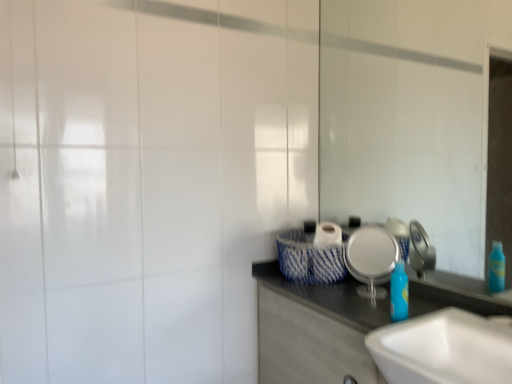
Describe the element at coordinates (314, 329) in the screenshot. I see `white glossy cabinet at lower right` at that location.

At what (x,y) coordinates should I click in order to perform the action: click on white glossy cabinet at lower right. Please return your answer as a coordinate pair (x, y). This screenshot has width=512, height=384. Looking at the image, I should click on 314,329.

This screenshot has width=512, height=384. In order to click on blue plastic bottle at center in this screenshot , I will do point(399,293).

What is the approximate height of silver metallic plate at center?

It is 24.47 centimeters.

You are a GUI agent. You are given a task and a screenshot of the screen. Output one action in this format:
    pyautogui.click(x=<x>, y=<y>)
    Task: Click on the white glossy cabinet at lower right
    
    Given the screenshot: What is the action you would take?
    pyautogui.click(x=314, y=329)

From the image's perspective, between blue plastic bottle at center and white glossy sink at lower right, which one is located above?

blue plastic bottle at center.

Which is in front, point (397, 285) or point (490, 344)?

Positioned in front is point (490, 344).

Which object is further away from the camera taking this photo, blue plastic bottle at center or white glossy sink at lower right?

blue plastic bottle at center is behind.

Is the depth of silver metallic plate at center greater than that of white glossy mirror at upper right?

Yes, silver metallic plate at center is further from the camera.

Between silver metallic plate at center and white glossy mirror at upper right, which one has larger width?

With larger width is silver metallic plate at center.

Which of these two, silver metallic plate at center or white glossy mirror at upper right, is smaller?

silver metallic plate at center is smaller.

The height and width of the screenshot is (384, 512). Identify the location of plate located below the white glossy mirror at upper right (from the image's perspective). (371, 255).

In the image, is white glossy sink at lower right positioned in front of or behind white glossy mirror at upper right?

In the image, white glossy sink at lower right appears in front of white glossy mirror at upper right.

What's the angular difference between white glossy sink at lower right and white glossy mirror at upper right's facing directions?

0.676 degrees separate the facing orientations of white glossy sink at lower right and white glossy mirror at upper right.

Based on the photo, is white glossy sink at lower right at the left side of white glossy mirror at upper right?

Yes.

Which is closer, [466,356] or [429,116]?

Point [466,356].

Considering the relative sizes of white glossy sink at lower right and white glossy cabinet at lower right in the image provided, is white glossy sink at lower right thinner than white glossy cabinet at lower right?

In fact, white glossy sink at lower right might be wider than white glossy cabinet at lower right.

Would you say white glossy sink at lower right is inside or outside white glossy cabinet at lower right?

white glossy sink at lower right lies within the bounds of white glossy cabinet at lower right.

Visually, is white glossy sink at lower right positioned to the left or to the right of white glossy cabinet at lower right?

Based on their positions, white glossy sink at lower right is located to the right of white glossy cabinet at lower right.

Is the surface of white glossy sink at lower right in direct contact with white glossy cabinet at lower right?

No, white glossy sink at lower right is not touching white glossy cabinet at lower right.

Considering the points (444, 379) and (360, 230), which point is in front, point (444, 379) or point (360, 230)?

Point (444, 379)

How far apart are white glossy sink at lower right and silver metallic plate at center?

The distance of white glossy sink at lower right from silver metallic plate at center is 13.04 inches.

Is white glossy sink at lower right oriented away from silver metallic plate at center?

No.

From a real-world perspective, who is located lower, white glossy sink at lower right or silver metallic plate at center?

white glossy sink at lower right.

Find the location of a particular element. The height and width of the screenshot is (384, 512). mirror located on the right of white glossy sink at lower right is located at coordinates (410, 116).

From a real-world perspective, which object rests below the other?

white glossy sink at lower right.

From the image's perspective, would you say white glossy mirror at upper right is shown under white glossy sink at lower right?

Actually, white glossy mirror at upper right appears above white glossy sink at lower right in the image.

Based on the photo, does white glossy mirror at upper right have a lesser height compared to white glossy sink at lower right?

Incorrect, the height of white glossy mirror at upper right does not fall short of that of white glossy sink at lower right.

Is silver metallic plate at center placed right next to blue plastic bottle at center?

silver metallic plate at center is not next to blue plastic bottle at center, and they're not touching.

Who is taller, silver metallic plate at center or blue plastic bottle at center?

Standing taller between the two is silver metallic plate at center.

Is silver metallic plate at center to the left of blue plastic bottle at center from the viewer's perspective?

Correct, you'll find silver metallic plate at center to the left of blue plastic bottle at center.

Between silver metallic plate at center and blue plastic bottle at center, which one has larger width?

silver metallic plate at center is wider.

This screenshot has height=384, width=512. I want to click on sink on the right of the blue plastic bottle at center, so click(x=444, y=349).

Where is `mirror in front of the silver metallic plate at center`? This screenshot has height=384, width=512. mirror in front of the silver metallic plate at center is located at coordinates (410, 116).

Which object lies further to the anchor point white glossy sink at lower right, white glossy mirror at upper right or blue plastic bottle at center?

white glossy mirror at upper right is positioned further to the anchor white glossy sink at lower right.

Looking at the image, which one is located closer to white glossy mirror at upper right, silver metallic plate at center or white glossy cabinet at lower right?

The object closer to white glossy mirror at upper right is silver metallic plate at center.

In the scene shown: Looking at the image, which one is located closer to blue plastic bottle at center, white glossy cabinet at lower right or silver metallic plate at center?

silver metallic plate at center is closer to blue plastic bottle at center.

Estimate the real-world distances between objects in this image. Which object is further from white glossy sink at lower right, silver metallic plate at center or white glossy cabinet at lower right?

silver metallic plate at center lies further to white glossy sink at lower right than the other object.

Based on their spatial positions, is silver metallic plate at center or blue plastic bottle at center closer to white glossy cabinet at lower right?

silver metallic plate at center is closer to white glossy cabinet at lower right.

Considering their positions, is white glossy cabinet at lower right positioned closer to white glossy sink at lower right than blue plastic bottle at center?

Among the two, blue plastic bottle at center is located nearer to white glossy sink at lower right.

When comparing their distances from white glossy cabinet at lower right, does white glossy mirror at upper right or silver metallic plate at center seem further?

white glossy mirror at upper right.

Estimate the real-world distances between objects in this image. Which object is further from white glossy mirror at upper right, white glossy sink at lower right or white glossy cabinet at lower right?

The object further to white glossy mirror at upper right is white glossy sink at lower right.

This screenshot has width=512, height=384. I want to click on bathroom cabinet between white glossy sink at lower right and blue plastic bottle at center along the z-axis, so pos(314,329).

Where is `bottle that lies between white glossy mirror at upper right and white glossy sink at lower right from top to bottom`? The width and height of the screenshot is (512, 384). bottle that lies between white glossy mirror at upper right and white glossy sink at lower right from top to bottom is located at coordinates (399, 293).

Locate an element on the screen. bathroom cabinet positioned between white glossy sink at lower right and silver metallic plate at center from near to far is located at coordinates (314, 329).

The image size is (512, 384). Identify the location of plate between white glossy mirror at upper right and blue plastic bottle at center from top to bottom. (371, 255).